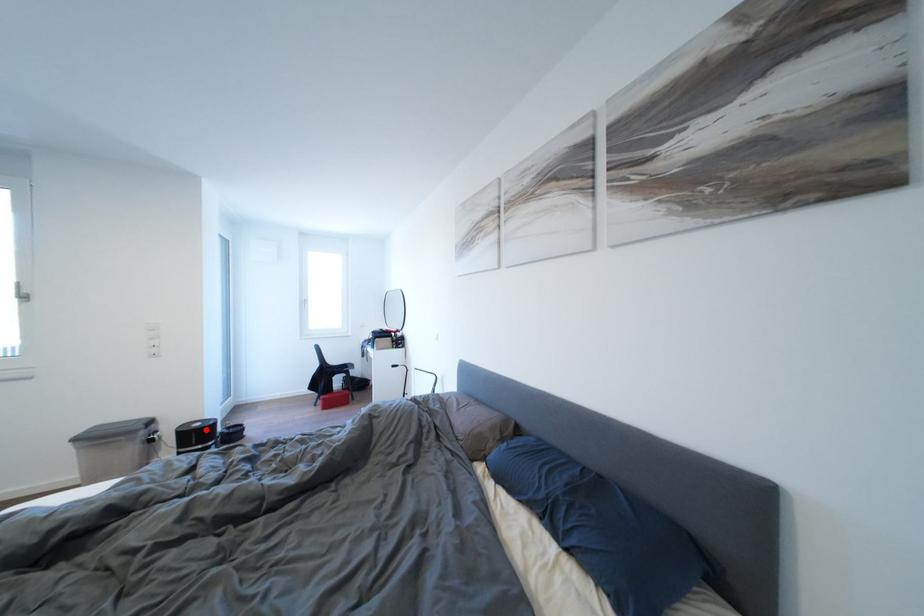
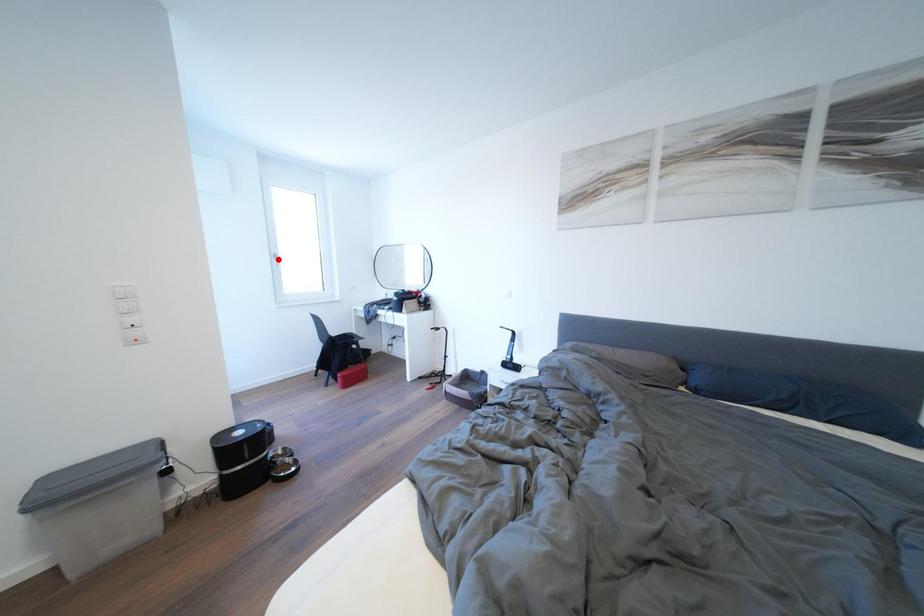
I am providing you with two images of the same scene from different viewpoints. A red point is marked on the first image and another point is marked on the second image. Is the marked point in image1 the same physical position as the marked point in image2?

No